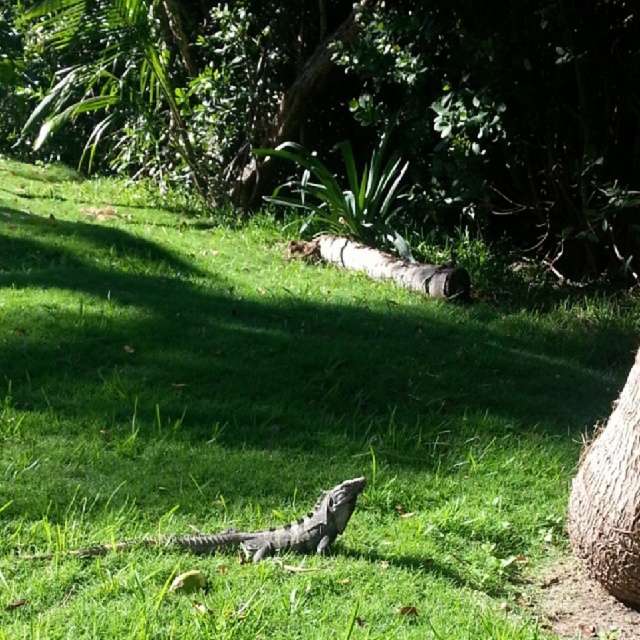
Question: Considering the real-world distances, which object is closest to the green leafy tree at upper center?

Choices:
 (A) green scaly lizard at center
 (B) brown rough tree trunk at lower right

Answer: (B)

Question: Can you confirm if green leafy tree at upper center is positioned to the left of brown rough tree trunk at lower right?

Choices:
 (A) yes
 (B) no

Answer: (A)

Question: Based on their relative distances, which object is farther from the brown rough tree trunk at lower right?

Choices:
 (A) brown rough log at center
 (B) green scaly lizard at center
 (C) green leafy tree at upper center

Answer: (C)

Question: Does green leafy tree at upper center have a smaller size compared to green scaly lizard at center?

Choices:
 (A) no
 (B) yes

Answer: (A)

Question: Where is green leafy tree at upper center located in relation to green scaly lizard at center in the image?

Choices:
 (A) below
 (B) above

Answer: (B)

Question: Among these objects, which one is farthest from the camera?

Choices:
 (A) green scaly lizard at center
 (B) green leafy tree at upper center
 (C) brown rough tree trunk at lower right
 (D) brown rough log at center

Answer: (B)